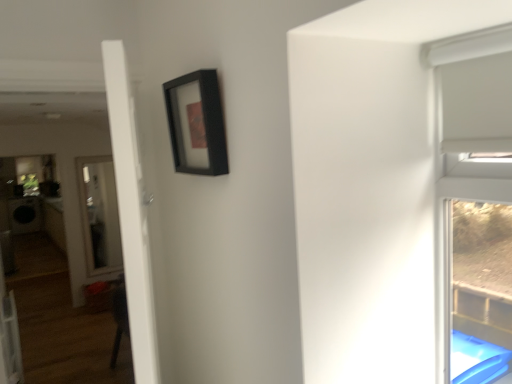
Question: Is the depth of black matte picture frame at upper center greater than that of white glossy door at left?

Choices:
 (A) no
 (B) yes

Answer: (B)

Question: From the image's perspective, is black matte picture frame at upper center under white glossy door at left?

Choices:
 (A) yes
 (B) no

Answer: (B)

Question: Does black matte picture frame at upper center turn towards white glossy door at left?

Choices:
 (A) yes
 (B) no

Answer: (A)

Question: Is black matte picture frame at upper center shorter than white glossy door at left?

Choices:
 (A) no
 (B) yes

Answer: (B)

Question: From the image's perspective, is black matte picture frame at upper center on white glossy door at left?

Choices:
 (A) no
 (B) yes

Answer: (B)

Question: Is black matte picture frame at upper center with white glossy door at left?

Choices:
 (A) no
 (B) yes

Answer: (A)

Question: Is white glossy door at left looking in the opposite direction of black matte picture frame at upper center?

Choices:
 (A) no
 (B) yes

Answer: (B)

Question: Is black matte picture frame at upper center located within white glossy door at left?

Choices:
 (A) yes
 (B) no

Answer: (B)

Question: From the image's perspective, does white glossy door at left appear lower than black matte picture frame at upper center?

Choices:
 (A) yes
 (B) no

Answer: (A)

Question: Is white glossy door at left outside of black matte picture frame at upper center?

Choices:
 (A) no
 (B) yes

Answer: (B)

Question: Considering the relative sizes of white glossy door at left and black matte picture frame at upper center in the image provided, is white glossy door at left shorter than black matte picture frame at upper center?

Choices:
 (A) yes
 (B) no

Answer: (B)

Question: Considering the relative sizes of white glossy door at left and black matte picture frame at upper center in the image provided, is white glossy door at left thinner than black matte picture frame at upper center?

Choices:
 (A) no
 (B) yes

Answer: (A)

Question: From a real-world perspective, is black matte picture frame at upper center above or below white glossy door at left?

Choices:
 (A) below
 (B) above

Answer: (B)